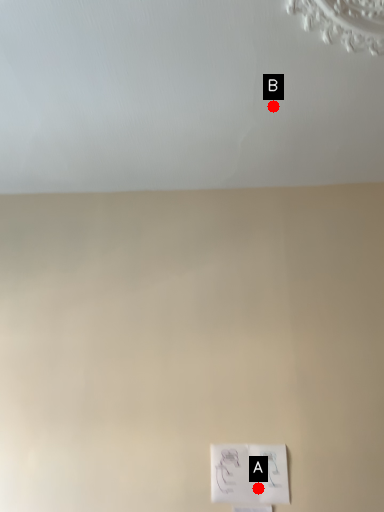
Question: Two points are circled on the image, labeled by A and B beside each circle. Among these points, which one is nearest to the camera?

Choices:
 (A) A is closer
 (B) B is closer

Answer: (B)